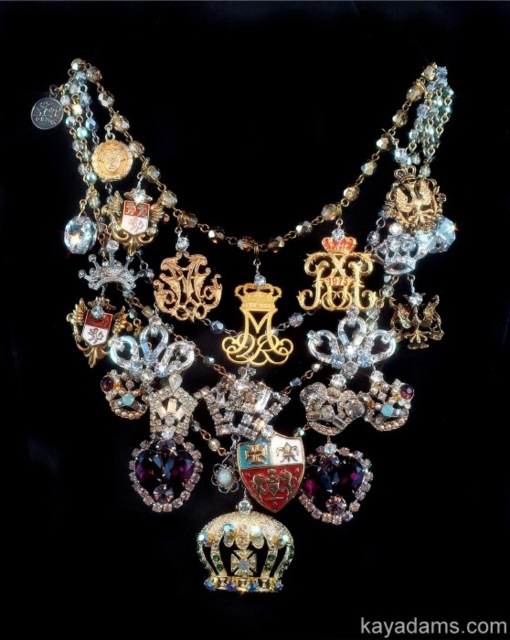
You are an appraiser examining the necklace. You notice two similar crown charms labeled as shiny gold crown at center and goldmetalliccrown at center. Which one is taller?

The shiny gold crown at center is much taller than the goldmetalliccrown at center.

You are an appraiser examining the necklace. You notice two crown charms labeled as shiny gold crown at center and goldmetalliccrown at center. Which of these two crown charms is bigger?

The shiny gold crown at center is larger in size than the goldmetalliccrown at center.

You are examining the necklace from the front. There are two points on the necklace labeled as point (171, 433) and point (351, 307). Which point is closer to your viewpoint?

Point (171, 433) is closer to the camera than point (351, 307).